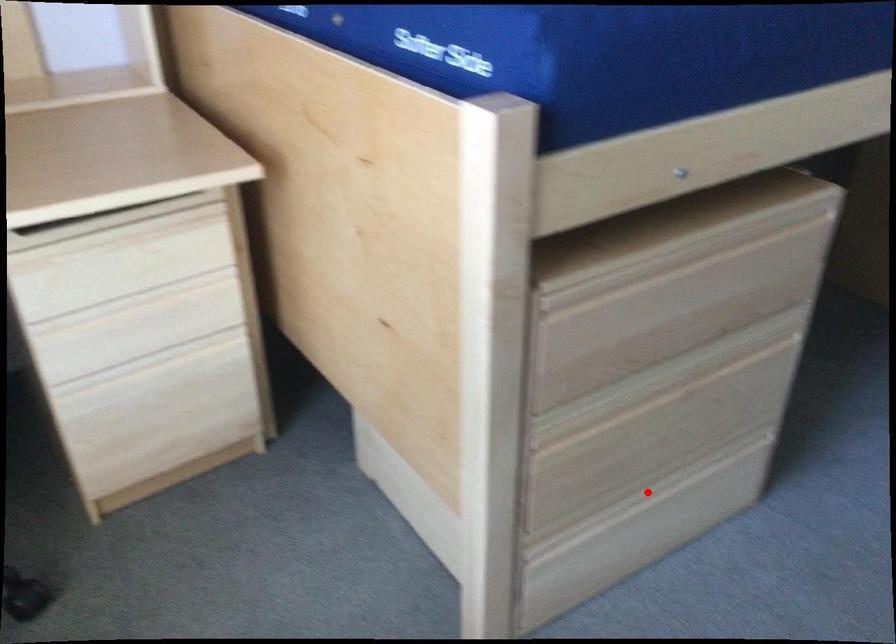
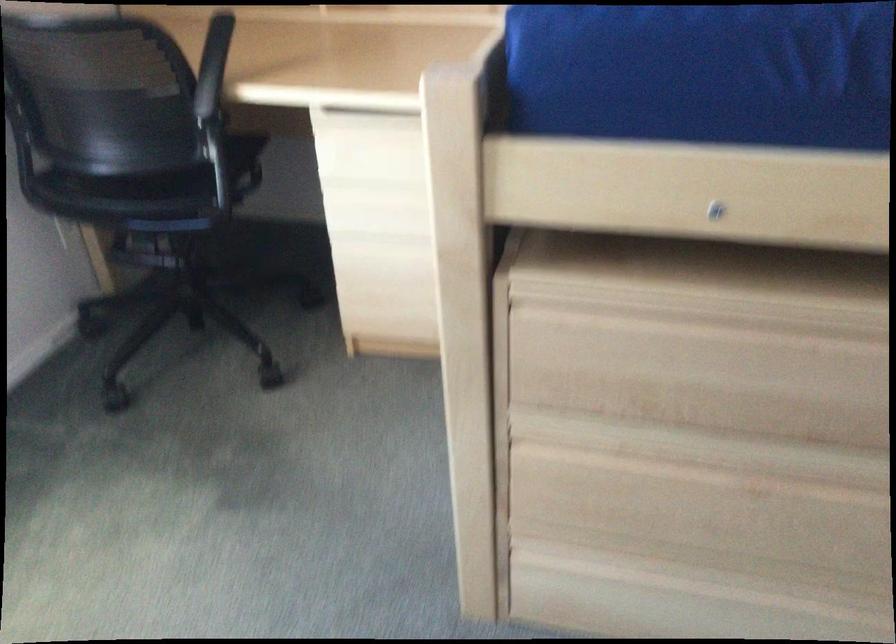
The point at the highlighted location is marked in the first image. Where is the corresponding point in the second image?

(705, 582)